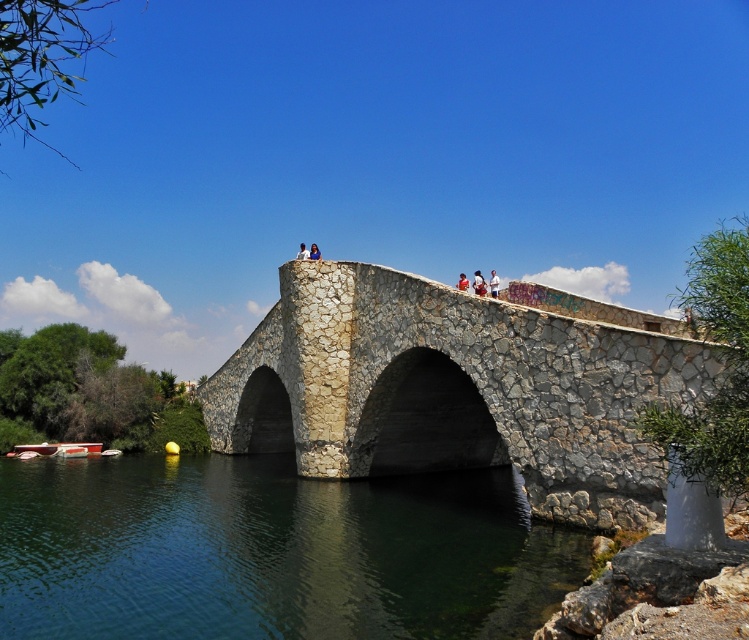
Between point (577, 436) and point (482, 294), which one is positioned in front?

Positioned in front is point (577, 436).

Does stone textured bridge at center appear under white cotton shirt at center?

Yes, stone textured bridge at center is below white cotton shirt at center.

I want to click on stone textured bridge at center, so click(x=452, y=390).

Does point (457, 515) lie in front of point (479, 275)?

Yes.

In the scene shown: Does green stone river at lower center appear under white cotton shirt at center?

Yes, green stone river at lower center is below white cotton shirt at center.

The height and width of the screenshot is (640, 749). In order to click on green stone river at lower center in this screenshot , I will do `click(270, 552)`.

Find the location of a particular element. This screenshot has width=749, height=640. green stone river at lower center is located at coordinates (270, 552).

Can you confirm if white cotton shirt at center is shorter than light blue fabric shirt at center?

Correct, white cotton shirt at center is not as tall as light blue fabric shirt at center.

Between white cotton shirt at center and light blue fabric shirt at center, which one has less height?

white cotton shirt at center

Image resolution: width=749 pixels, height=640 pixels. In order to click on white cotton shirt at center in this screenshot , I will do `click(479, 284)`.